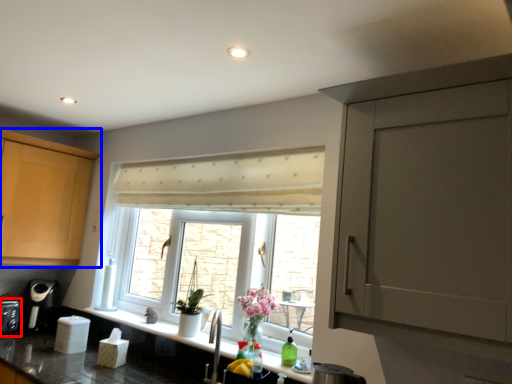
Question: Which of the following is the farthest to the observer, appliance (highlighted by a red box) or cabinetry (highlighted by a blue box)?

Choices:
 (A) appliance
 (B) cabinetry

Answer: (A)